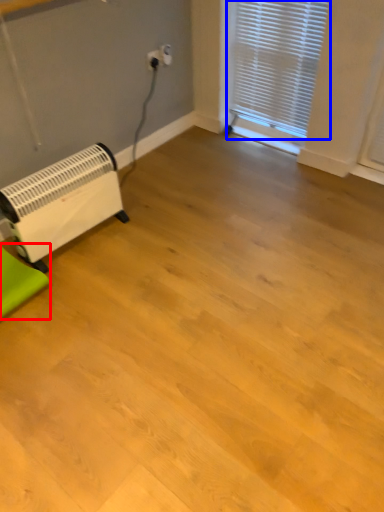
Question: Which point is closer to the camera, furniture (highlighted by a red box) or window blind (highlighted by a blue box)?

Choices:
 (A) furniture
 (B) window blind

Answer: (A)